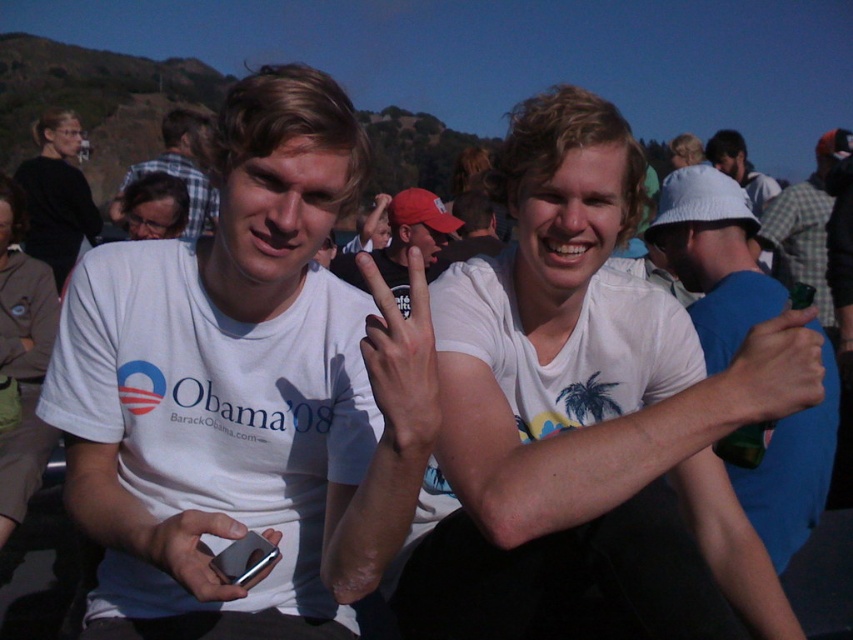
Which is more to the right, white matte hat at upper right or light brown hair at upper center?

Positioned to the right is light brown hair at upper center.

Does point (805, 520) come behind point (682, 134)?

No, it is in front of (682, 134).

What are the coordinates of `white matte hat at upper right` in the screenshot? It's located at (714, 259).

The image size is (853, 640). Find the location of `white matte hat at upper right`. white matte hat at upper right is located at coordinates (714, 259).

Does black matte shirt at upper left have a larger size compared to white cotton hat at upper right?

Yes, black matte shirt at upper left is bigger than white cotton hat at upper right.

Which is above, black matte shirt at upper left or white cotton hat at upper right?

white cotton hat at upper right is above.

Find the location of `black matte shirt at upper left`. black matte shirt at upper left is located at coordinates (56, 195).

Does black matte shirt at upper left appear over plaid shirt at center?

Incorrect, black matte shirt at upper left is not positioned above plaid shirt at center.

Is black matte shirt at upper left wider than plaid shirt at center?

No, black matte shirt at upper left is not wider than plaid shirt at center.

Is point (51, 141) less distant than point (184, 132)?

No, (51, 141) is behind (184, 132).

Locate an element on the screen. black matte shirt at upper left is located at coordinates (56, 195).